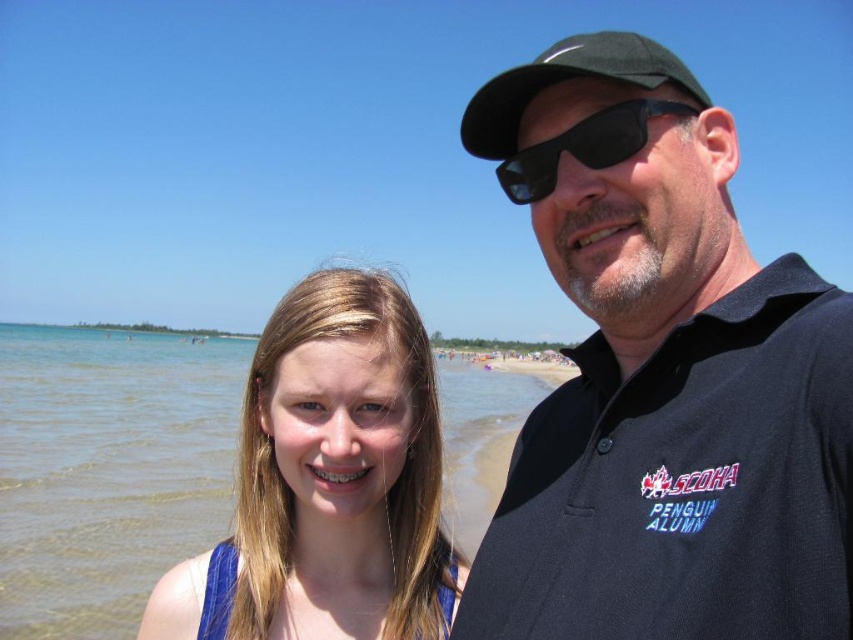
You are a photographer trying to capture a closeup of the blonde hair at center in the image. The camera is currently focused on the point at coordinates point (329, 481). Is the camera focused on the correct location?

Yes, the camera is focused on the correct location because the point (329, 481) corresponds to the blonde hair at center.

Consider the image. You are a photographer trying to capture a clear shot of the black matte cap at upper right and the black matte sunglasses at upper center. Since you want to ensure both items are in focus, you need to know which one is taller. Can you determine which object is taller?

The black matte cap at upper right is much taller as the black matte sunglasses at upper center, so the cap is taller than the sunglasses.